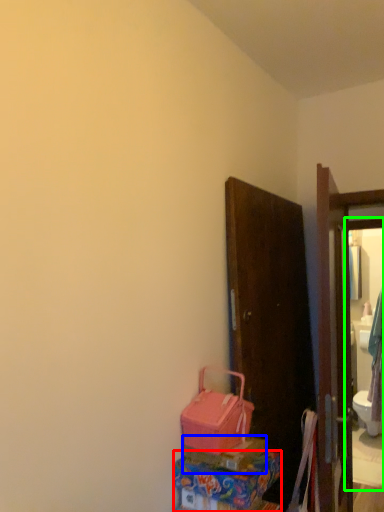
Question: Which is farther away from box (highlighted by a red box)? box (highlighted by a blue box) or mirror (highlighted by a green box)?

Choices:
 (A) box
 (B) mirror

Answer: (B)